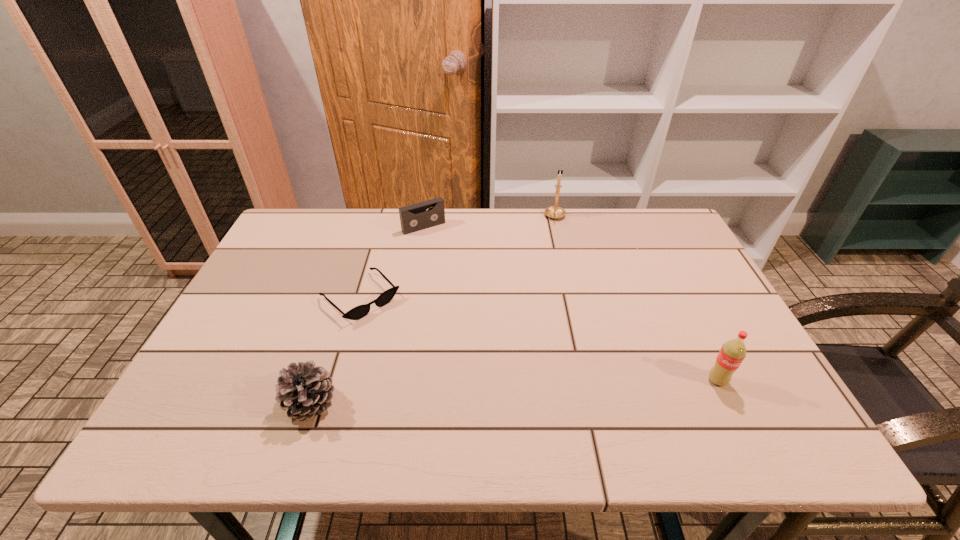
Identify the location of vacant position located on the handle side of the candle holder. Image resolution: width=960 pixels, height=540 pixels. (555, 276).

Where is `blank space located on the front-facing side of the shortest object`? This screenshot has height=540, width=960. blank space located on the front-facing side of the shortest object is located at coordinates (446, 382).

This screenshot has width=960, height=540. I want to click on blank space located on the front-facing side of the shortest object, so click(x=428, y=363).

You are a GUI agent. You are given a task and a screenshot of the screen. Output one action in this format:
    pyautogui.click(x=<x>, y=<y>)
    Task: Click on the vacant region located 0.090m on the front-facing side of the shortest object
    
    Given the screenshot: What is the action you would take?
    pyautogui.click(x=403, y=339)

Image resolution: width=960 pixels, height=540 pixels. I want to click on vacant space located on the front-facing side of the videotape, so click(485, 302).

The image size is (960, 540). In order to click on vacant area situated on the front-facing side of the videotape in this screenshot , I will do `click(478, 293)`.

You are a GUI agent. You are given a task and a screenshot of the screen. Output one action in this format:
    pyautogui.click(x=<x>, y=<y>)
    Task: Click on the vacant region located on the front-facing side of the videotape
    
    Given the screenshot: What is the action you would take?
    pyautogui.click(x=453, y=260)

The height and width of the screenshot is (540, 960). Identify the location of candle holder positioned at the far edge. (555, 212).

Where is `videotape that is at the far edge`? The image size is (960, 540). videotape that is at the far edge is located at coordinates (414, 217).

Find the location of a particular element. pinecone that is positioned at the near edge is located at coordinates (304, 390).